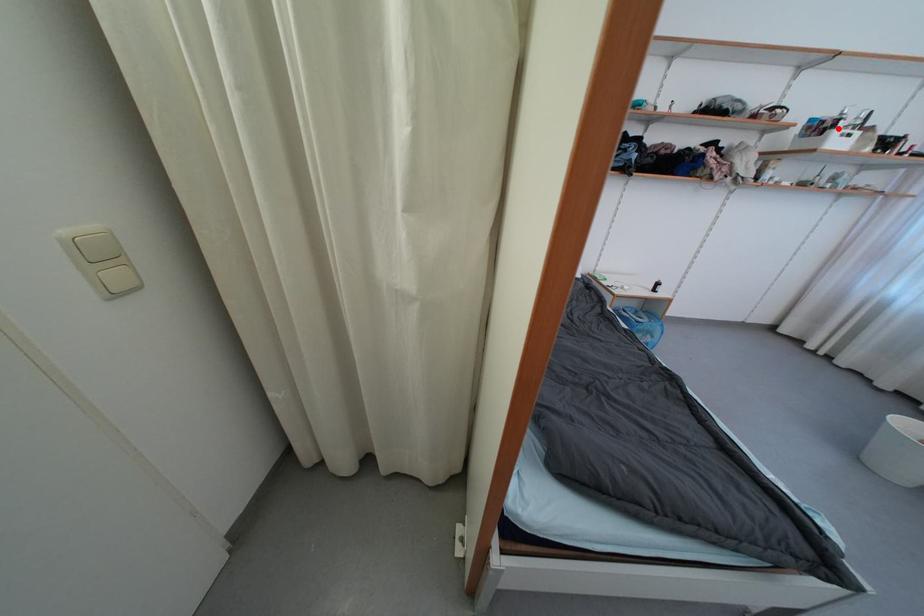
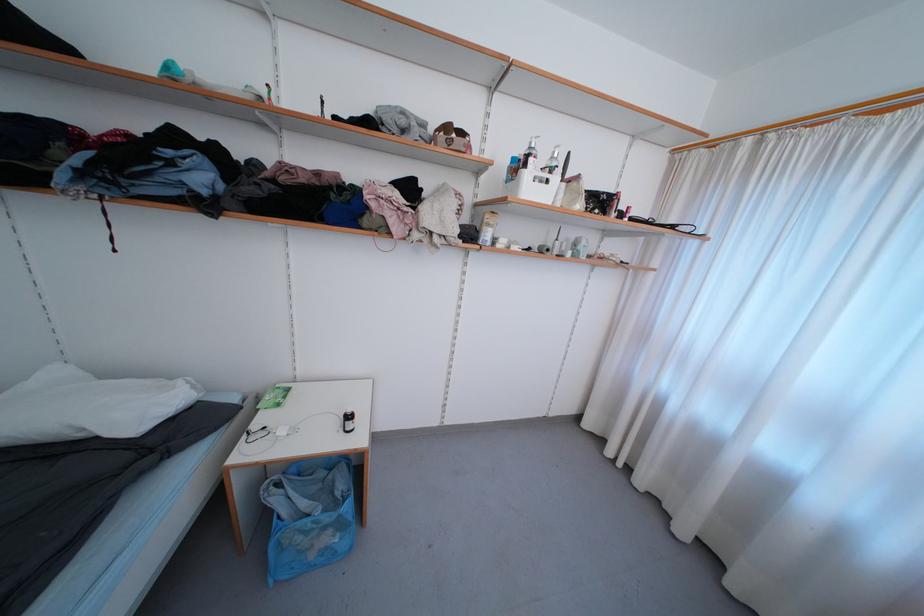
Find the pixel in the second image that matches the highlighted location in the first image.

(529, 168)